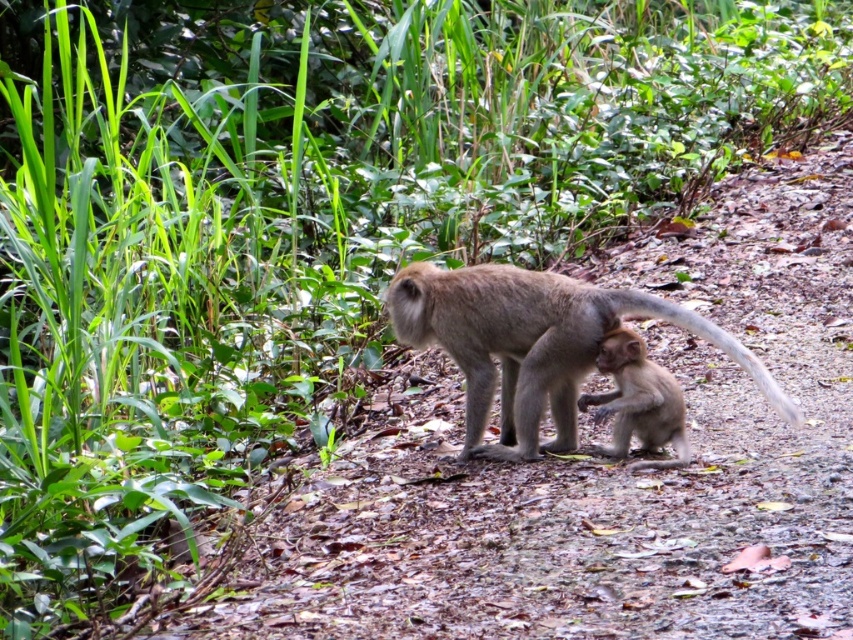
Question: Can you confirm if brown furry monkey at center is smaller than smooth brown monkey at center?

Choices:
 (A) yes
 (B) no

Answer: (B)

Question: From the image, what is the correct spatial relationship of brown furry monkey at center in relation to smooth brown monkey at center?

Choices:
 (A) left
 (B) right

Answer: (A)

Question: Is brown furry monkey at center in front of smooth brown monkey at center?

Choices:
 (A) no
 (B) yes

Answer: (B)

Question: Which object appears farthest from the camera in this image?

Choices:
 (A) brown furry monkey at center
 (B) smooth brown monkey at center

Answer: (B)